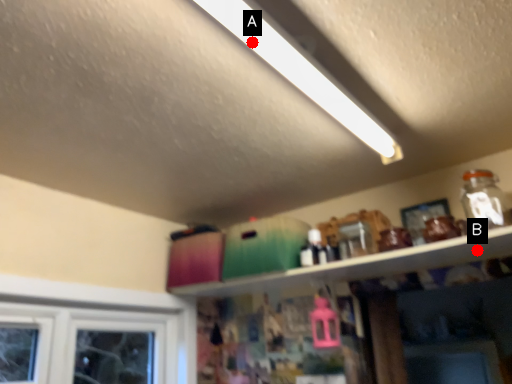
Question: Two points are circled on the image, labeled by A and B beside each circle. Which point is closer to the camera taking this photo?

Choices:
 (A) A is closer
 (B) B is closer

Answer: (A)